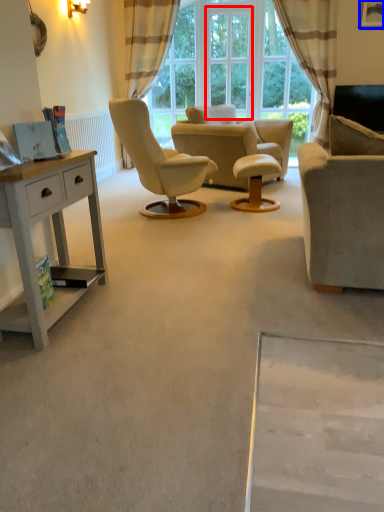
Question: Which object is further to the camera taking this photo, window screen (highlighted by a red box) or picture frame (highlighted by a blue box)?

Choices:
 (A) window screen
 (B) picture frame

Answer: (A)